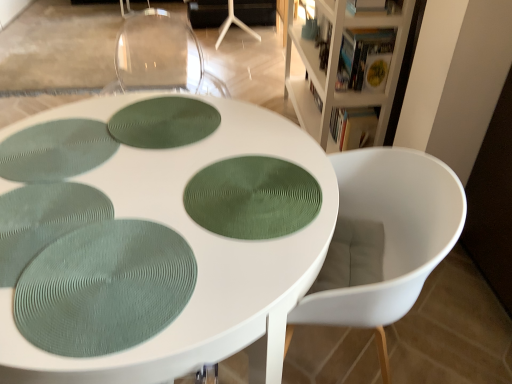
Where is `vacant space behind green textured placemat at center, positioned as the second oval in top-to-bottom order`? The image size is (512, 384). vacant space behind green textured placemat at center, positioned as the second oval in top-to-bottom order is located at coordinates (227, 140).